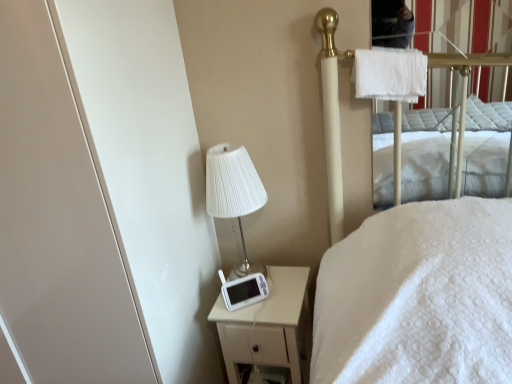
Identify the location of free spot in front of white pleated fabric lampshade at upper left. This screenshot has height=384, width=512. (251, 297).